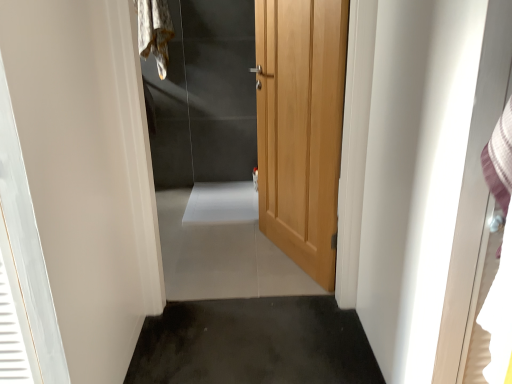
The image size is (512, 384). What are the coordinates of `vacant space underneath light wood door at center (from a real-world perspective)` in the screenshot? It's located at pyautogui.click(x=288, y=259).